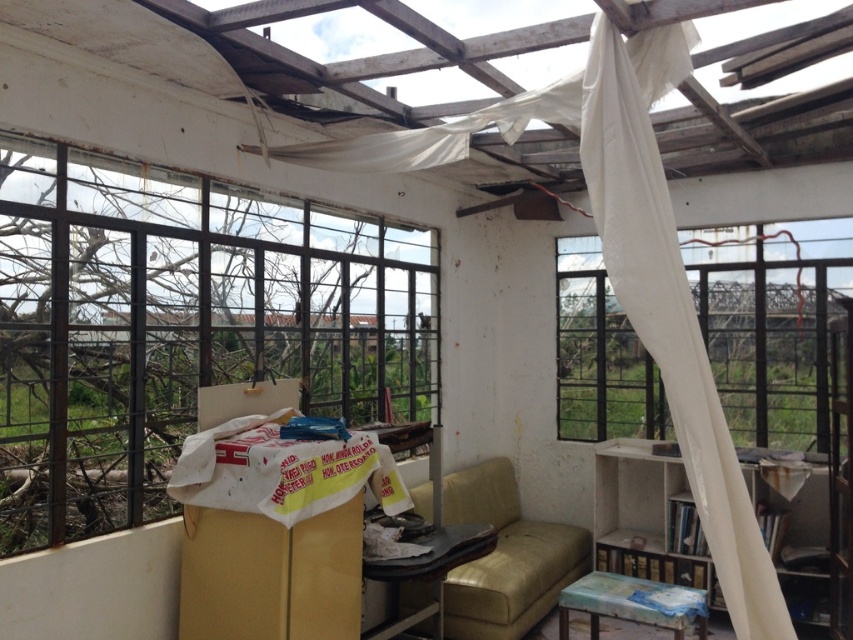
Can you confirm if leather couch at center is shorter than matte green cushion at lower center?

No.

Which is in front, point (461, 579) or point (700, 605)?

Point (700, 605) is more forward.

Locate an element on the screen. leather couch at center is located at coordinates (505, 557).

Can you confirm if white fabric curtain at upper right is wider than matte green cushion at lower center?

Incorrect, white fabric curtain at upper right's width does not surpass matte green cushion at lower center's.

Between point (590, 131) and point (581, 586), which one is positioned in front?

Positioned in front is point (590, 131).

Find the location of a particular element. The width and height of the screenshot is (853, 640). white fabric curtain at upper right is located at coordinates (669, 300).

Is matte green cushion at lower center bigger than leather-like green sofa at center?

Indeed, matte green cushion at lower center has a larger size compared to leather-like green sofa at center.

Who is more forward, (668, 625) or (393, 624)?

Point (668, 625)

Where is `matte green cushion at lower center`? The image size is (853, 640). matte green cushion at lower center is located at coordinates (631, 604).